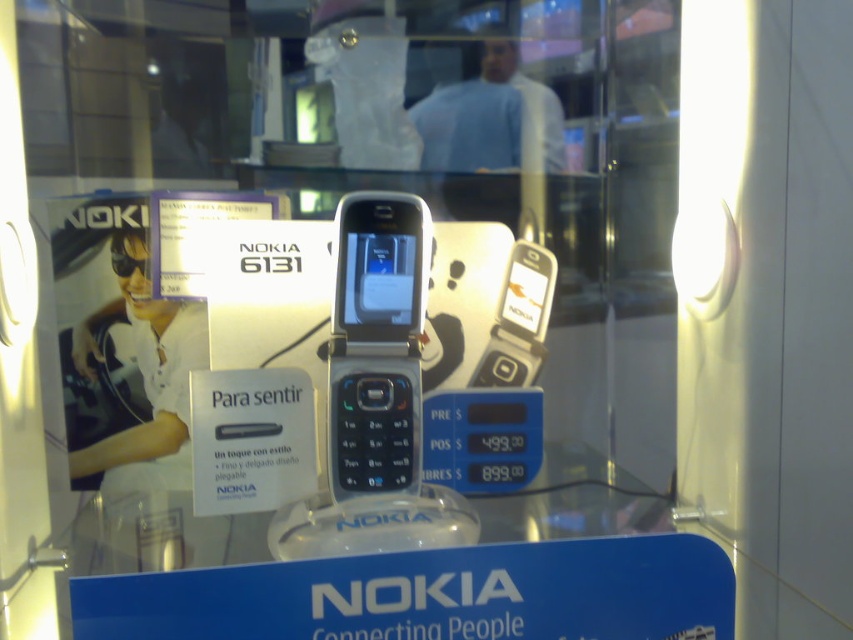
Does silver metallic phone at center have a greater width compared to transparent glass table at center?

Indeed, silver metallic phone at center has a greater width compared to transparent glass table at center.

Who is higher up, silver metallic phone at center or transparent glass table at center?

silver metallic phone at center is above.

Between point (489, 12) and point (550, 464), which one is positioned behind?

The point (489, 12) is behind.

You are a GUI agent. You are given a task and a screenshot of the screen. Output one action in this format:
    pyautogui.click(x=<x>, y=<y>)
    Task: Click on the silver metallic phone at center
    Image resolution: width=853 pixels, height=640 pixels.
    Given the screenshot: What is the action you would take?
    pyautogui.click(x=328, y=243)